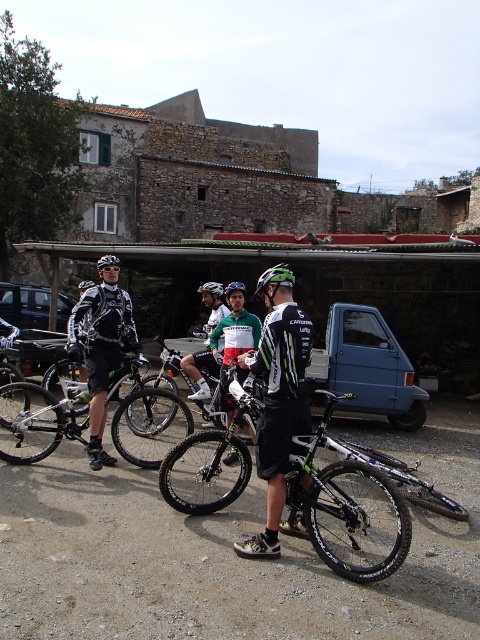
Is shiny black bike at center smaller than black matte car at center?

No, shiny black bike at center is not smaller than black matte car at center.

Does point (12, 442) come in front of point (54, 336)?

Yes, point (12, 442) is closer to viewer.

The image size is (480, 640). Find the location of `shiny black bike at center`. shiny black bike at center is located at coordinates (35, 422).

Is black matte bicycle at center bigger than matte black helmet at center?

Incorrect, black matte bicycle at center is not larger than matte black helmet at center.

Does black matte bicycle at center appear over matte black helmet at center?

Actually, black matte bicycle at center is below matte black helmet at center.

Which is behind, point (254, 554) or point (212, 291)?

Point (212, 291)

Find the location of a particular element. black matte bicycle at center is located at coordinates (278, 401).

Can you confirm if metallic blue car at left is positioned to the left of matte black helmet at center?

Indeed, metallic blue car at left is positioned on the left side of matte black helmet at center.

In order to click on metallic blue car at left in this screenshot , I will do (24, 305).

The image size is (480, 640). I want to click on metallic blue car at left, so click(24, 305).